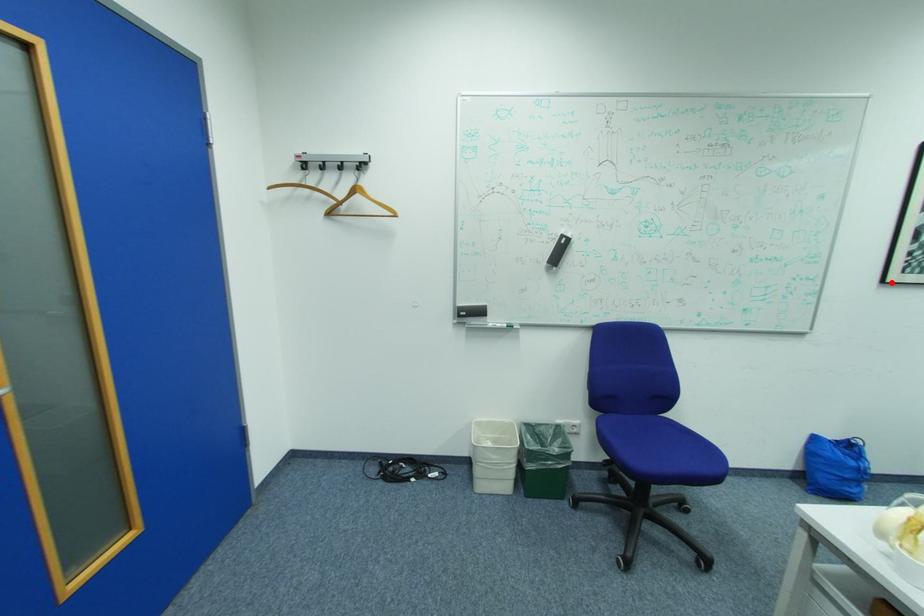
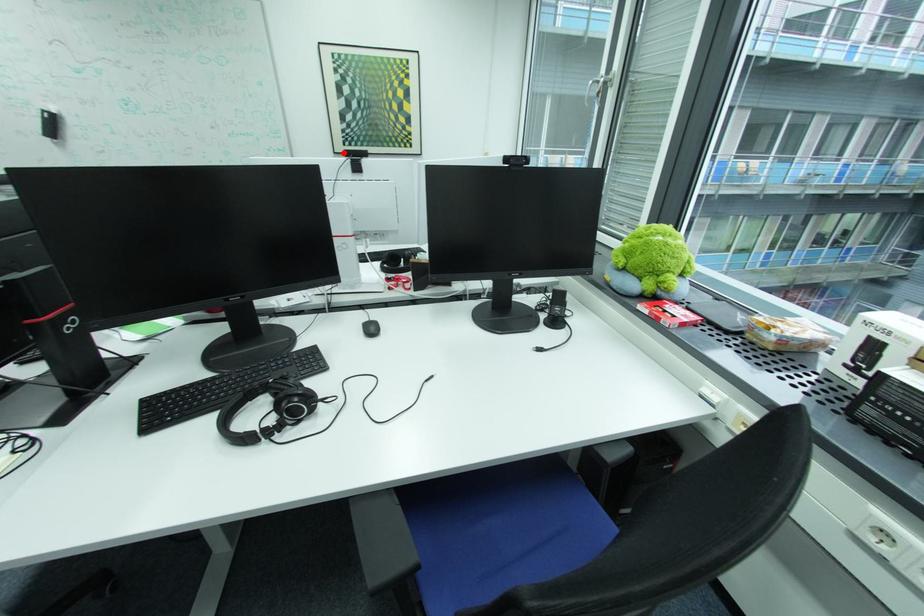
I am providing you with two images of the same scene from different viewpoints. A red point is marked on the first image and another point is marked on the second image. Is the red point in image1 aligned with the point shown in image2?

Yes